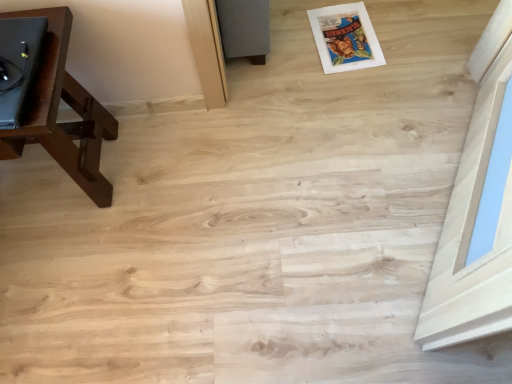
You are a GUI agent. You are given a task and a screenshot of the screen. Output one action in this format:
    pyautogui.click(x=<x>, y=<y>)
    Task: Click on the vacant area situated below brown wood tv stand at left (from a real-world perspective)
    This screenshot has height=384, width=512.
    Given the screenshot: What is the action you would take?
    pyautogui.click(x=47, y=179)